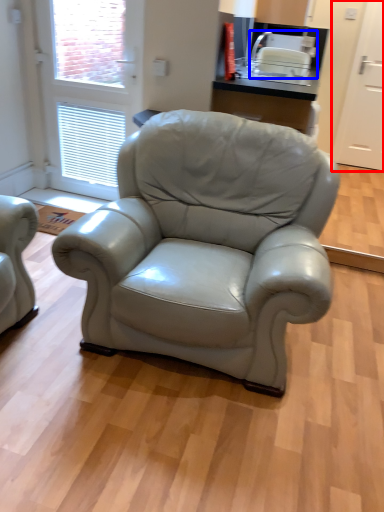
Question: Which object appears closest to the camera in this image, screen door (highlighted by a red box) or appliance (highlighted by a blue box)?

Choices:
 (A) screen door
 (B) appliance

Answer: (B)